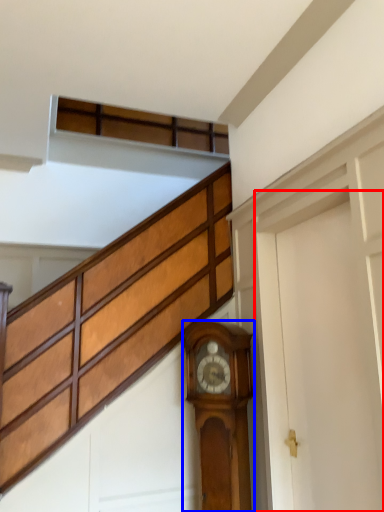
Question: Which point is further to the camera, garage door (highlighted by a red box) or wall clock (highlighted by a blue box)?

Choices:
 (A) garage door
 (B) wall clock

Answer: (B)